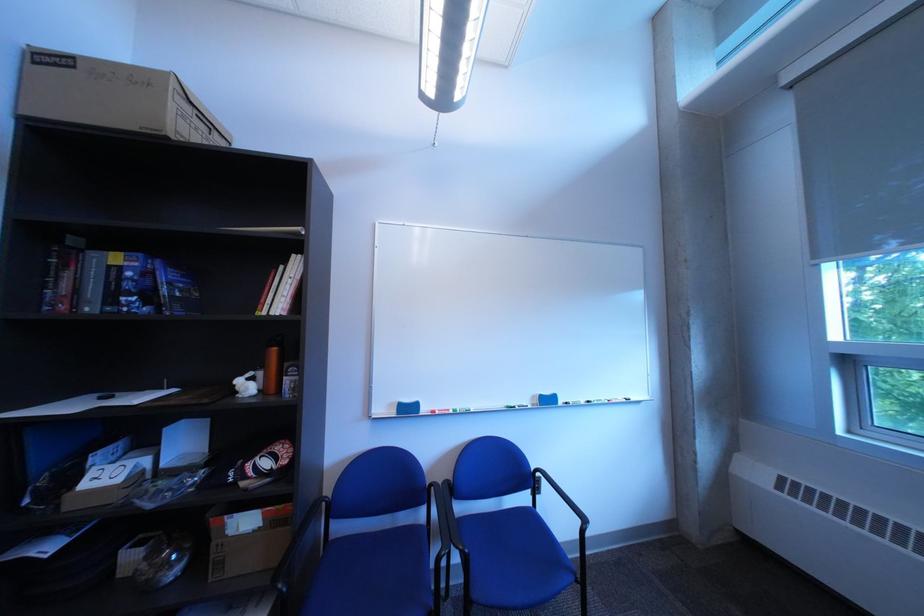
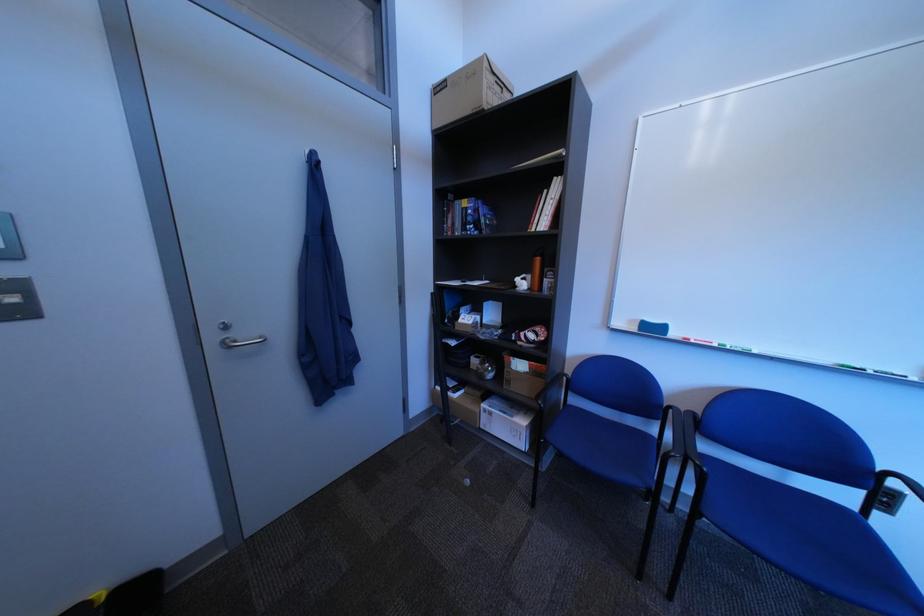
Where in the second image is the point corresponding to pixel 467 413 from the first image?

(732, 347)